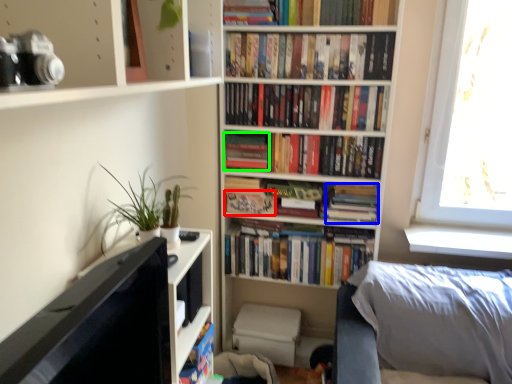
Question: Which is nearer to the paperback book (highlighted by a red box)? paperback book (highlighted by a blue box) or paperback book (highlighted by a green box).

Choices:
 (A) paperback book
 (B) paperback book

Answer: (B)